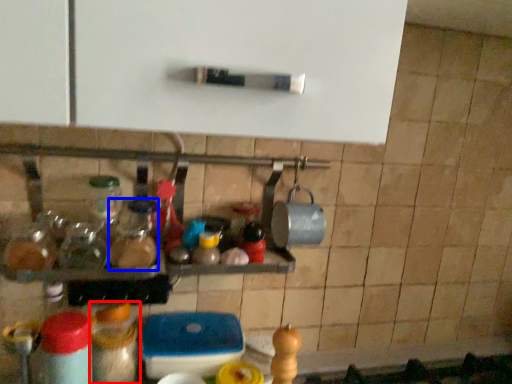
Question: Which object is closer to the camera taking this photo, bottle (highlighted by a red box) or bottle (highlighted by a blue box)?

Choices:
 (A) bottle
 (B) bottle

Answer: (B)